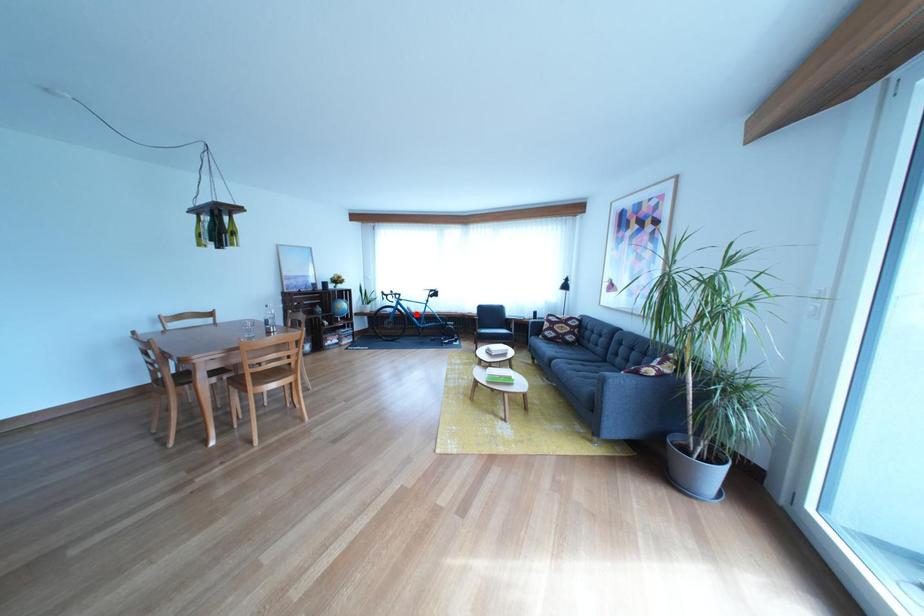
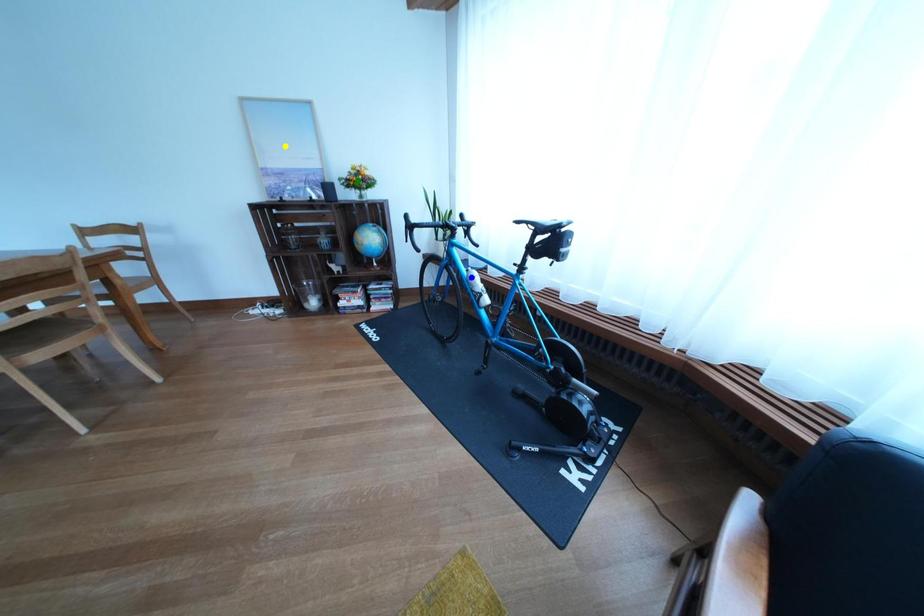
Question: I am providing you with two images of the same scene from different viewpoints. A red point is marked on the first image. You are given multiple points on the second image. Which point in image 2 is actually the same real-world point as the red point in image 1?

Choices:
 (A) green point
 (B) yellow point
 (C) blue point

Answer: (C)